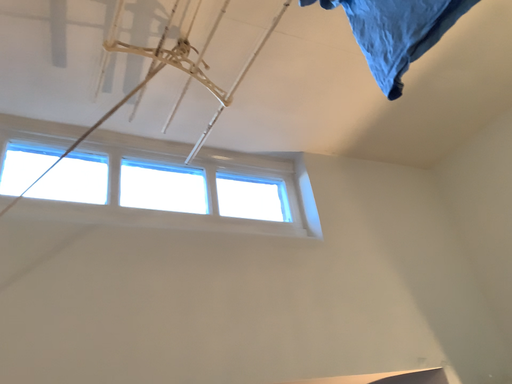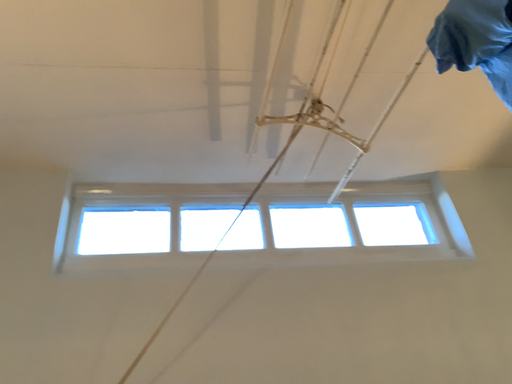
Question: How did the camera likely rotate when shooting the video?

Choices:
 (A) rotated right
 (B) rotated left

Answer: (B)